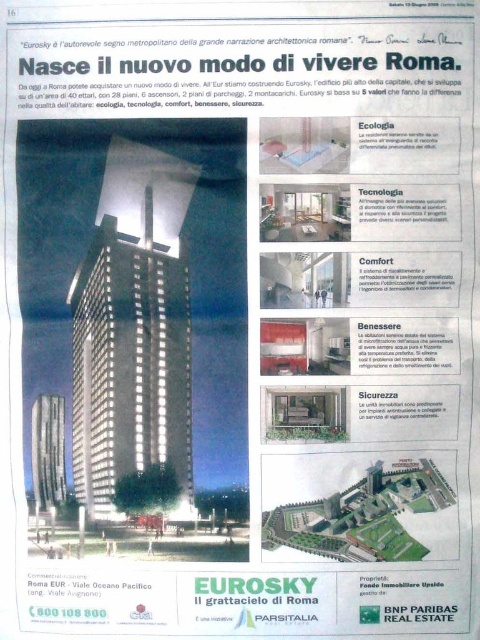
Between point (139, 365) and point (40, 444), which one is positioned behind?

The point (40, 444) is more distant.

Is matte glass skyscraper at center closer to camera compared to silver metallic tower at center?

Yes, matte glass skyscraper at center is in front of silver metallic tower at center.

Locate an element on the screen. matte glass skyscraper at center is located at coordinates (133, 332).